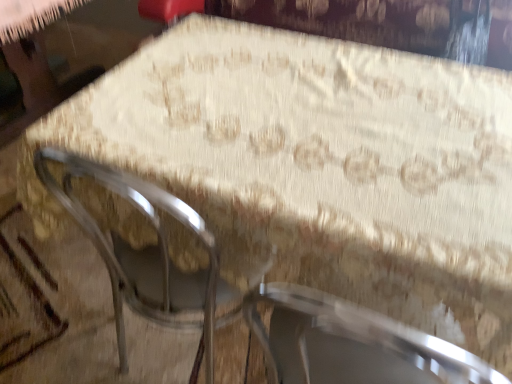
Describe the element at coordinates (146, 253) in the screenshot. The width and height of the screenshot is (512, 384). I see `metallic silver chair at lower left` at that location.

Locate an element on the screen. metallic silver chair at lower left is located at coordinates (146, 253).

Find the location of a particular element. metallic silver chair at lower left is located at coordinates [146, 253].